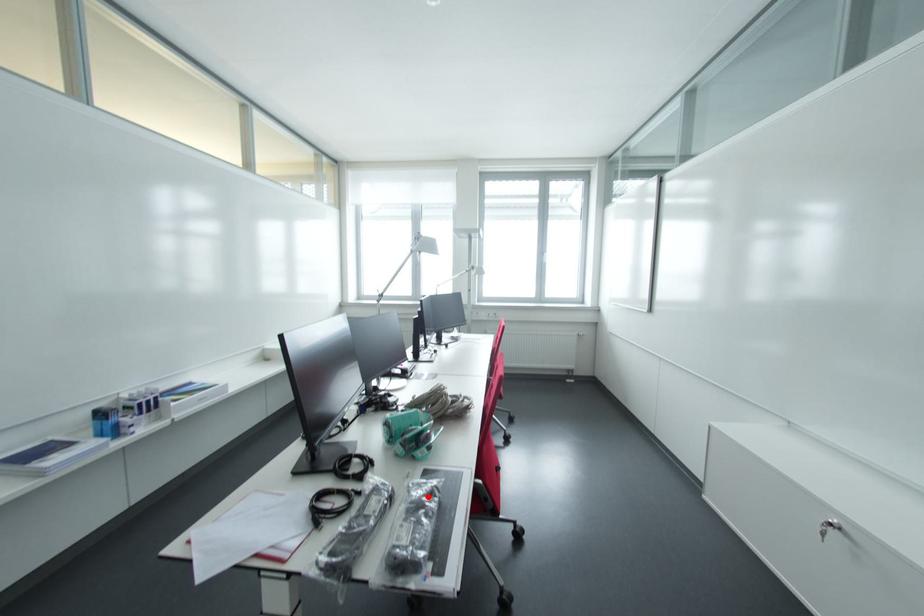
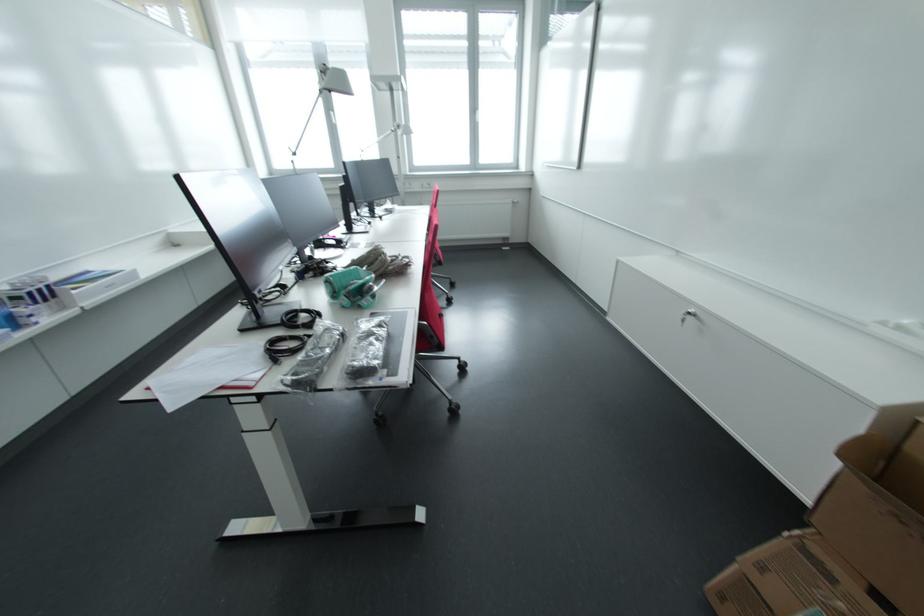
In the second image, find the point that corresponds to the highlighted location in the first image.

(377, 329)